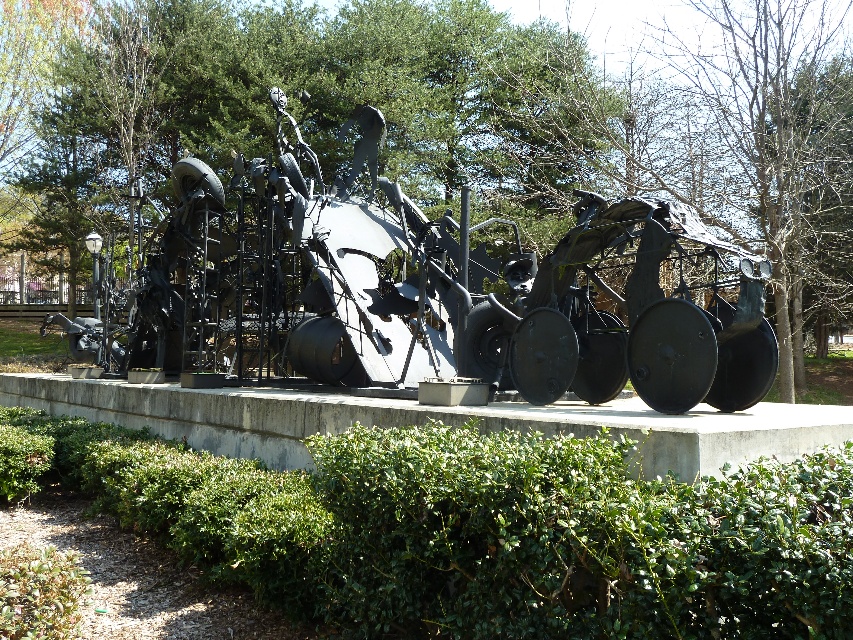
You are a landscape architect planning to install a new pathway between the green leafy hedge at center and the black metal sculpture at center. The pathway needs to be at least 5 meters long to accommodate visitors. Based on the current spacing between these two objects, will the pathway meet the required length?

The green leafy hedge at center and black metal sculpture at center are 5.52 meters apart from each other, which exceeds the required 5 meters. Therefore, the pathway will meet the required length.

You are a gardener who needs to trim the green leafy hedge at center and the black metal sculpture at center. Which object should you approach first if you want to start with the one closer to the path on the left?

The black metal sculpture at center is closer to the path on the left because the green leafy hedge at center is positioned on its right side.